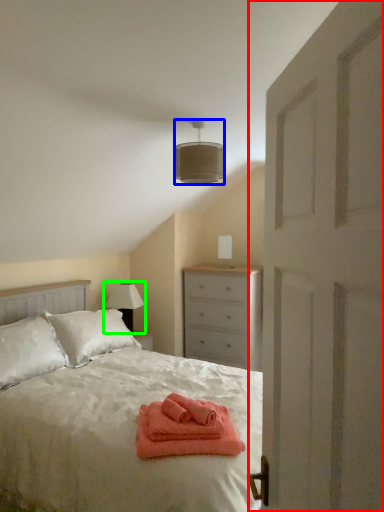
Question: Which object is the farthest from door (highlighted by a red box)? Choose among these: lamp (highlighted by a blue box) or table lamp (highlighted by a green box).

Choices:
 (A) lamp
 (B) table lamp

Answer: (B)